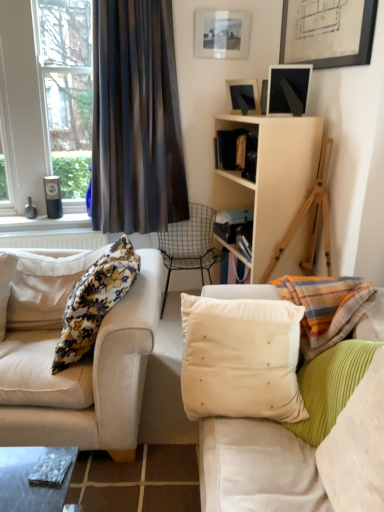
Question: Considering the positions of dark sheer curtain at left and matte black picture frame at upper center, the second picture frame positioned from the top, in the image, is dark sheer curtain at left wider or thinner than matte black picture frame at upper center, the second picture frame positioned from the top,?

Choices:
 (A) wide
 (B) thin

Answer: (A)

Question: Considering the positions of dark sheer curtain at left and matte black picture frame at upper center, the second picture frame positioned from the top, in the image, is dark sheer curtain at left bigger or smaller than matte black picture frame at upper center, the second picture frame positioned from the top,?

Choices:
 (A) small
 (B) big

Answer: (B)

Question: Based on their relative distances, which object is nearer to the dark sheer curtain at left?

Choices:
 (A) matte black picture frame at upper center, the second picture frame positioned from the top
 (B) linen cushion at right, acting as the 3th pillow starting from the left
 (C) white plastic radiator at lower left
 (D) matte black picture frame at upper right, marked as the 3th picture frame in a top-to-bottom arrangement
 (E) beige fabric couch at left

Answer: (A)

Question: Which of these objects is positioned farthest from the floral fabric pillow at left, positioned as the 1th pillow in left-to-right order?

Choices:
 (A) matte black picture frame at upper center, the second picture frame positioned from the top
 (B) beige velvet cushion at center, the second pillow in the right-to-left sequence
 (C) linen cushion at right, acting as the 3th pillow starting from the left
 (D) beige fabric couch at left
 (E) matte glass picture frame at upper center, arranged as the third picture frame when ordered from the bottom

Answer: (E)